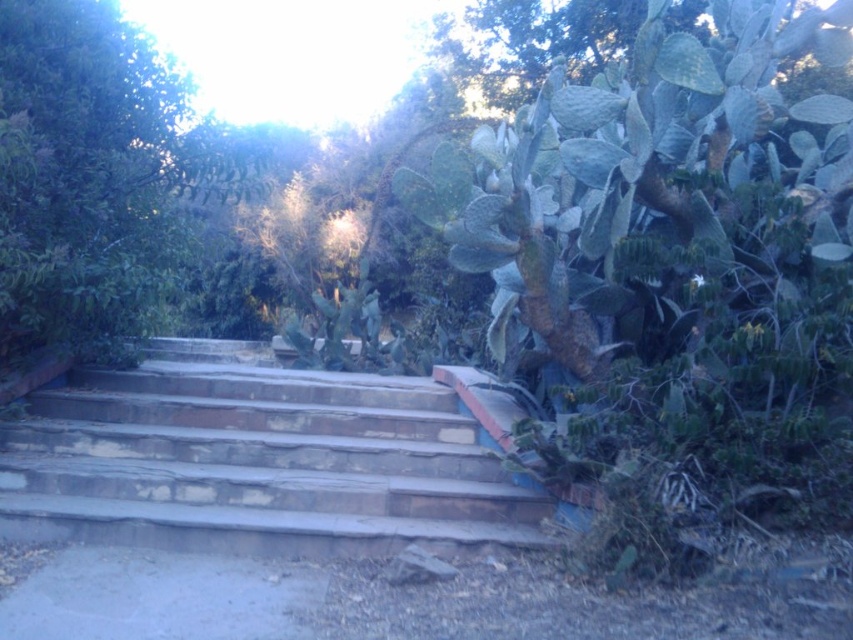
You are standing at the bottom of the stone stairs at center and want to reach the green leafy tree at upper left. Considering their heights, which one is shorter and would require less climbing effort?

The stone stairs at center has a lesser height compared to green leafy tree at upper left, so the stone stairs at center is shorter and requires less climbing effort.

You are standing at the bottom of the stone stairs at center. If you walk straight ahead, will you eventually reach the cactus to your right?

No, walking straight ahead from the bottom of the stone stairs at center will lead you further up the stairs, not towards the cactus to your right.

You are standing at the bottom of the stone stairs at center and want to reach the green leafy tree at upper left. Which direction should you move in to get closer to the tree?

You should move upwards along the stone stairs at center since they are located below the green leafy tree at upper left, indicating the tree is above the stairs.